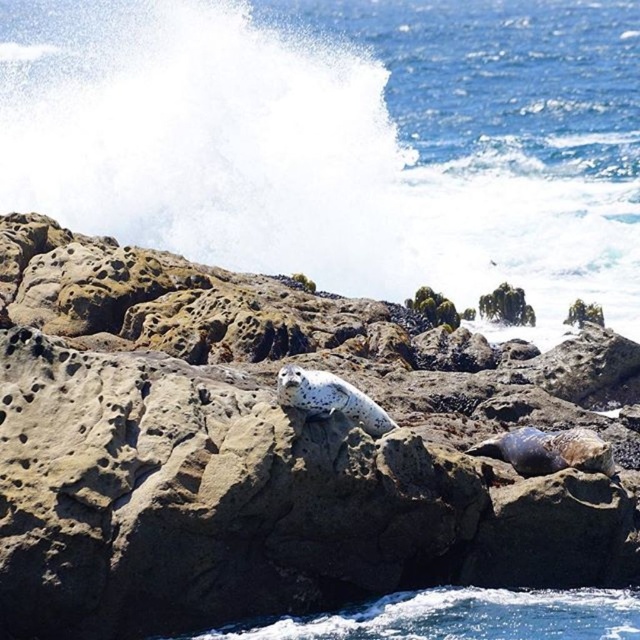
Question: Can you confirm if speckled gray rock at center is positioned to the right of blue water at upper center?

Choices:
 (A) yes
 (B) no

Answer: (A)

Question: From the image, what is the correct spatial relationship of speckled gray rock at center in relation to blue water at upper center?

Choices:
 (A) left
 (B) right

Answer: (B)

Question: Among these points, which one is nearest to the camera?

Choices:
 (A) (99, 140)
 (B) (349, 440)

Answer: (B)

Question: Which of the following is the farthest from the observer?

Choices:
 (A) speckled gray rock at center
 (B) blue water at upper center

Answer: (B)

Question: Which of the following is the closest to the observer?

Choices:
 (A) (301, 138)
 (B) (61, 428)

Answer: (B)

Question: Does speckled gray rock at center lie in front of blue water at upper center?

Choices:
 (A) yes
 (B) no

Answer: (A)